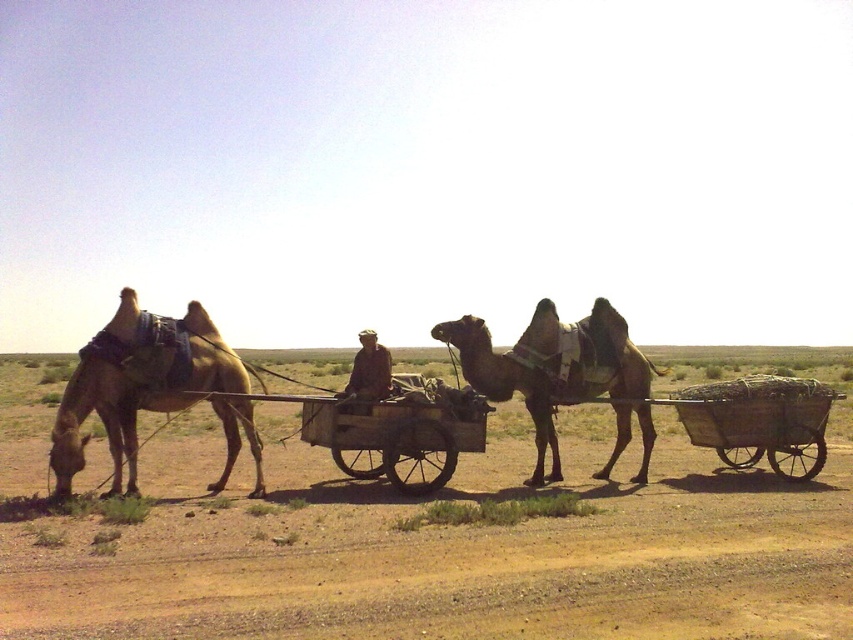
Is point (477, 600) behind point (453, 460)?

No.

Is brown sandy dirt at center closer to camera compared to wooden cart at center?

Yes, brown sandy dirt at center is in front of wooden cart at center.

I want to click on brown sandy dirt at center, so click(x=430, y=544).

At what (x,y) coordinates should I click in order to perform the action: click on brown sandy dirt at center. Please return your answer as a coordinate pair (x, y). The width and height of the screenshot is (853, 640). Looking at the image, I should click on (430, 544).

Does brown textured camel at center appear under brown fabric hat at center?

Actually, brown textured camel at center is above brown fabric hat at center.

Who is shorter, brown textured camel at center or brown fabric hat at center?

With less height is brown fabric hat at center.

Identify the location of brown textured camel at center. (561, 376).

Is brown textured camel at left thinner than brown textured camel at center?

Indeed, brown textured camel at left has a lesser width compared to brown textured camel at center.

Who is more forward, [202,356] or [556,451]?

Point [202,356] is in front.

I want to click on brown textured camel at left, so click(138, 384).